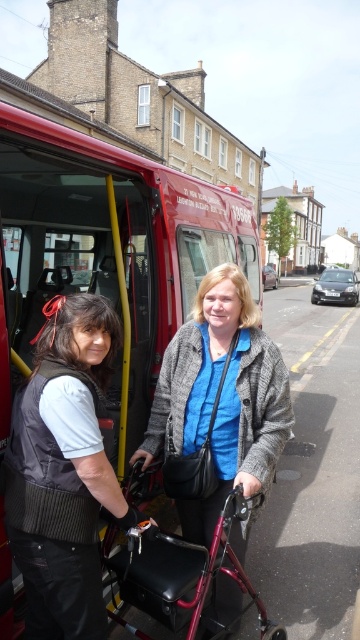
You are a pedestrian trying to cross the street where the red matte bus at center and the matte gray coat at center are located. Which object should you avoid stepping in front of to stay safe?

The red matte bus at center is to the left of matte gray coat at center. Since the bus is likely stationary with its door open, you should avoid stepping in front of the red matte bus at center to stay safe as it might start moving unexpectedly.

You are a delivery person who needs to place a package between the red matte bus at center and the matte gray coat at center. The package requires 4 feet of space. Will there be enough space?

The distance between the red matte bus at center and the matte gray coat at center is 3.82 feet, which is less than the required 4 feet. Therefore, there isn not enough space to place the package.